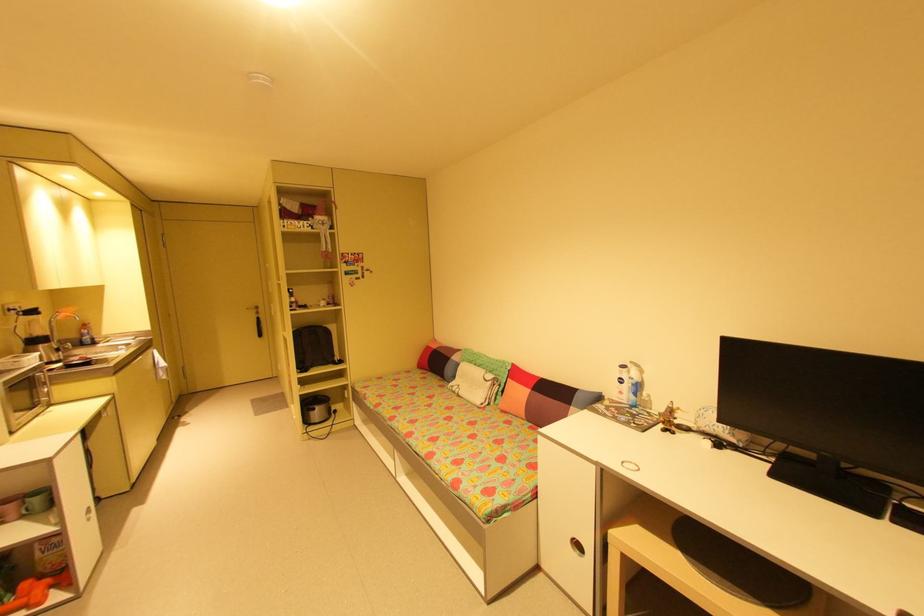
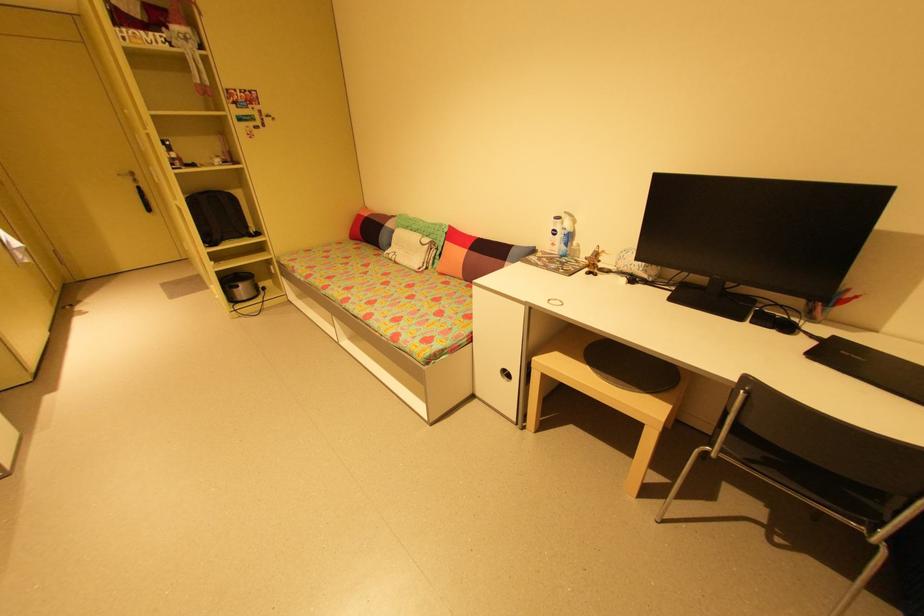
Find the pixel in the second image that matches pixel 641 387 in the first image.

(574, 237)